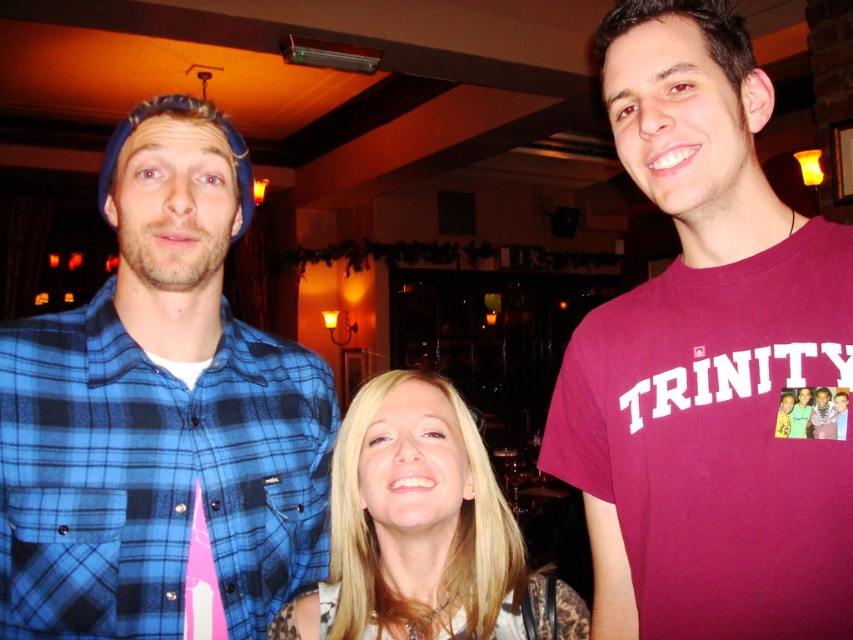
Does maroon t-shirt at center have a lesser width compared to blue flannel shirt at left?

Indeed, maroon t-shirt at center has a lesser width compared to blue flannel shirt at left.

Who is more forward, (689,129) or (225,196)?

Point (689,129) is in front.

This screenshot has height=640, width=853. Identify the location of maroon t-shirt at center. (705, 360).

Is blue flannel shirt at left above blonde hair at center?

Indeed, blue flannel shirt at left is positioned over blonde hair at center.

How much distance is there between blue flannel shirt at left and blonde hair at center?

blue flannel shirt at left and blonde hair at center are 8.05 inches apart from each other.

I want to click on blue flannel shirt at left, so click(x=160, y=417).

Who is more distant from viewer, (634, 97) or (389, 545)?

The point (389, 545) is more distant.

Between maroon t-shirt at center and blonde hair at center, which one is positioned lower?

blonde hair at center is lower down.

Is point (830, 464) positioned behind point (477, 621)?

No.

This screenshot has width=853, height=640. I want to click on maroon t-shirt at center, so click(705, 360).